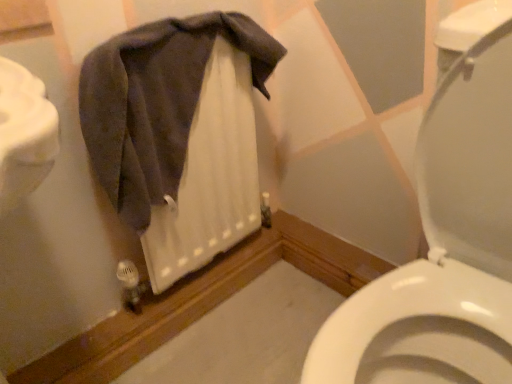
Question: Is white glossy toilet at center to the left of dark gray cotton towel at upper left from the viewer's perspective?

Choices:
 (A) no
 (B) yes

Answer: (A)

Question: Is white glossy toilet at center directly adjacent to dark gray cotton towel at upper left?

Choices:
 (A) yes
 (B) no

Answer: (B)

Question: Is white glossy toilet at center positioned beyond the bounds of dark gray cotton towel at upper left?

Choices:
 (A) no
 (B) yes

Answer: (B)

Question: Is white glossy toilet at center wider than dark gray cotton towel at upper left?

Choices:
 (A) no
 (B) yes

Answer: (B)

Question: From the image's perspective, is white glossy toilet at center on dark gray cotton towel at upper left?

Choices:
 (A) yes
 (B) no

Answer: (B)

Question: Is white glossy toilet at center facing towards dark gray cotton towel at upper left?

Choices:
 (A) yes
 (B) no

Answer: (B)

Question: From a real-world perspective, does dark gray cotton towel at upper left sit lower than white glossy toilet at center?

Choices:
 (A) no
 (B) yes

Answer: (A)

Question: From the image's perspective, would you say dark gray cotton towel at upper left is shown under white glossy toilet at center?

Choices:
 (A) no
 (B) yes

Answer: (A)

Question: Could white glossy toilet at center be considered to be inside dark gray cotton towel at upper left?

Choices:
 (A) no
 (B) yes

Answer: (A)

Question: Considering the relative sizes of dark gray cotton towel at upper left and white glossy toilet at center in the image provided, is dark gray cotton towel at upper left shorter than white glossy toilet at center?

Choices:
 (A) no
 (B) yes

Answer: (B)

Question: Is there a large distance between dark gray cotton towel at upper left and white glossy toilet at center?

Choices:
 (A) no
 (B) yes

Answer: (A)

Question: Is dark gray cotton towel at upper left facing towards white glossy toilet at center?

Choices:
 (A) yes
 (B) no

Answer: (A)

Question: Is dark gray cotton towel at upper left taller or shorter than white glossy toilet at center?

Choices:
 (A) tall
 (B) short

Answer: (B)